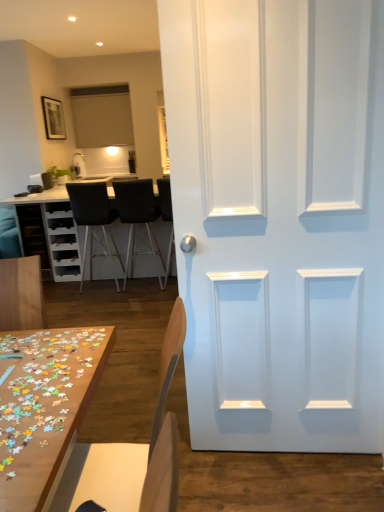
This screenshot has width=384, height=512. In order to click on free space above wooden puzzle pieces at lower left, the 2th table from the top (from a real-world perspective) in this screenshot , I will do `click(47, 388)`.